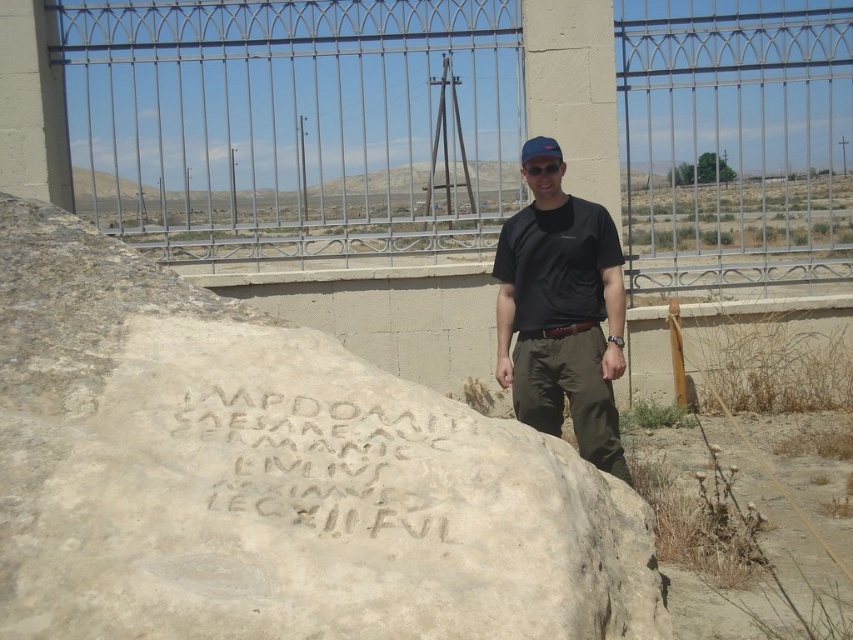
Does brushed metal fence at upper center appear over black matte shirt at center?

Yes.

Based on the photo, who is positioned more to the left, brushed metal fence at upper center or black matte shirt at center?

Positioned to the left is black matte shirt at center.

You are a GUI agent. You are given a task and a screenshot of the screen. Output one action in this format:
    pyautogui.click(x=<x>, y=<y>)
    Task: Click on the brushed metal fence at upper center
    Image resolution: width=853 pixels, height=640 pixels.
    Given the screenshot: What is the action you would take?
    pyautogui.click(x=294, y=124)

Where is `brushed metal fence at upper center`? brushed metal fence at upper center is located at coordinates (294, 124).

Can you confirm if light beige stone boulder at center is taller than carved stone inscription at center?

Indeed, light beige stone boulder at center has a greater height compared to carved stone inscription at center.

Between light beige stone boulder at center and carved stone inscription at center, which one appears on the right side from the viewer's perspective?

carved stone inscription at center

Which is in front, point (4, 481) or point (231, 433)?

Point (4, 481) is in front.

Locate an element on the screen. The width and height of the screenshot is (853, 640). light beige stone boulder at center is located at coordinates (271, 476).

Can you confirm if brushed metal fence at upper center is smaller than blue fabric baseball cap at center?

Incorrect, brushed metal fence at upper center is not smaller in size than blue fabric baseball cap at center.

Does brushed metal fence at upper center have a greater height compared to blue fabric baseball cap at center?

Yes, brushed metal fence at upper center is taller than blue fabric baseball cap at center.

Is point (352, 38) positioned in front of point (529, 145)?

No.

Where is `brushed metal fence at upper center`? Image resolution: width=853 pixels, height=640 pixels. brushed metal fence at upper center is located at coordinates (294, 124).